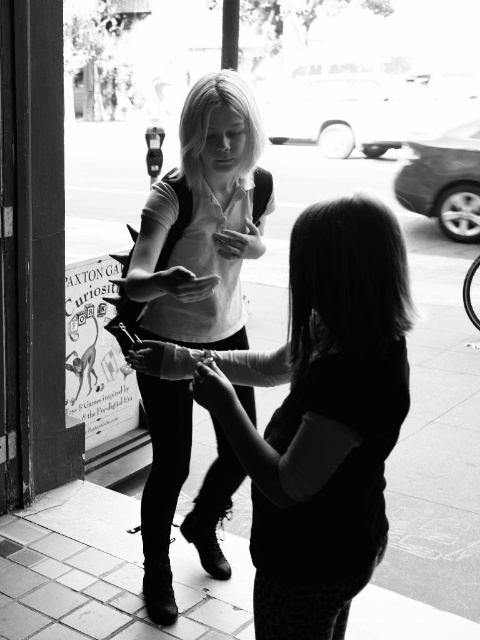
Question: Which of the following is the closest to the observer?

Choices:
 (A) (402, 321)
 (B) (165, 612)

Answer: (A)

Question: Which point appears closest to the camera in this image?

Choices:
 (A) pos(215,339)
 (B) pos(343,435)

Answer: (B)

Question: Can you confirm if matte black shirt at center is thinner than matte white shirt at center?

Choices:
 (A) yes
 (B) no

Answer: (B)

Question: Can you confirm if matte black shirt at center is thinner than matte white shirt at center?

Choices:
 (A) yes
 (B) no

Answer: (B)

Question: Which point is closer to the camera taking this photo?

Choices:
 (A) click(283, 584)
 (B) click(228, 496)

Answer: (A)

Question: Is matte black shirt at center smaller than matte white shirt at center?

Choices:
 (A) yes
 (B) no

Answer: (A)